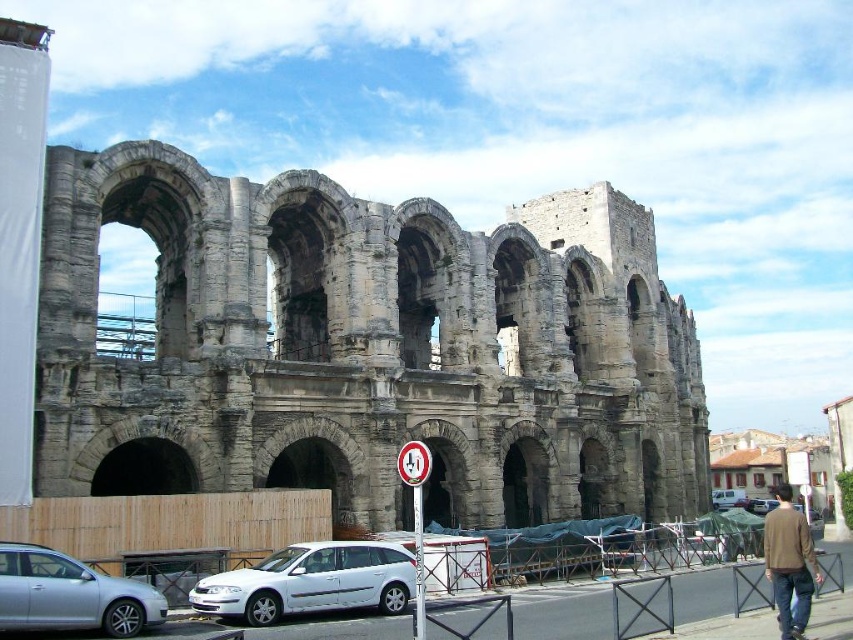
Based on the photo, which is above, metallic reflective sign at center or white matte van at center?

Positioned higher is metallic reflective sign at center.

Which of these two, metallic reflective sign at center or white matte van at center, stands taller?

Standing taller between the two is white matte van at center.

Where is `metallic reflective sign at center`? metallic reflective sign at center is located at coordinates (415, 461).

At what (x,y) coordinates should I click in order to perform the action: click on metallic reflective sign at center. Please return your answer as a coordinate pair (x, y). Looking at the image, I should click on (415, 461).

Does white matte car at lower center appear on the left side of white plastic sign at center?

Correct, you'll find white matte car at lower center to the left of white plastic sign at center.

Does white matte car at lower center have a lesser height compared to white plastic sign at center?

Yes, white matte car at lower center is shorter than white plastic sign at center.

What do you see at coordinates (311, 580) in the screenshot?
I see `white matte car at lower center` at bounding box center [311, 580].

Where is `white matte car at lower center`? The image size is (853, 640). white matte car at lower center is located at coordinates (311, 580).

Does silver metallic car at lower left appear on the left side of metallic reflective sign at center?

→ Correct, you'll find silver metallic car at lower left to the left of metallic reflective sign at center.

The height and width of the screenshot is (640, 853). In order to click on silver metallic car at lower left in this screenshot , I will do `click(70, 595)`.

Is point (85, 577) closer to viewer compared to point (409, 454)?

Yes, it is in front of point (409, 454).

Where is `silver metallic car at lower left`? The height and width of the screenshot is (640, 853). silver metallic car at lower left is located at coordinates (70, 595).